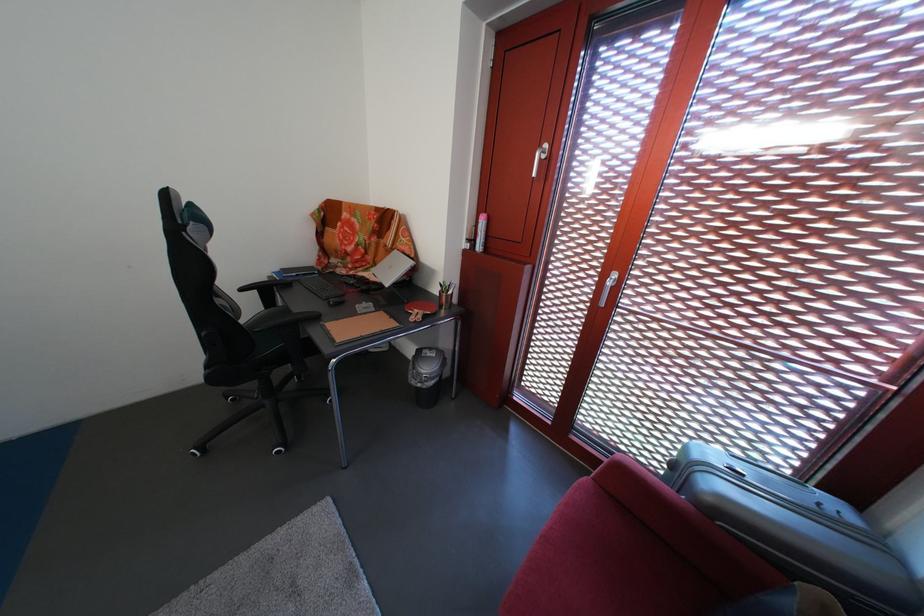
Describe the element at coordinates (427, 375) in the screenshot. I see `the small trash can` at that location.